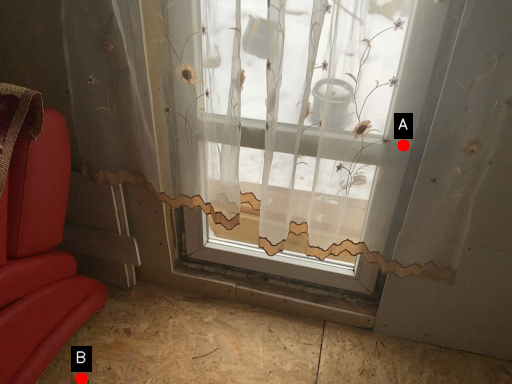
Question: Two points are circled on the image, labeled by A and B beside each circle. Which of the following is the farthest from the observer?

Choices:
 (A) A is further
 (B) B is further

Answer: (B)